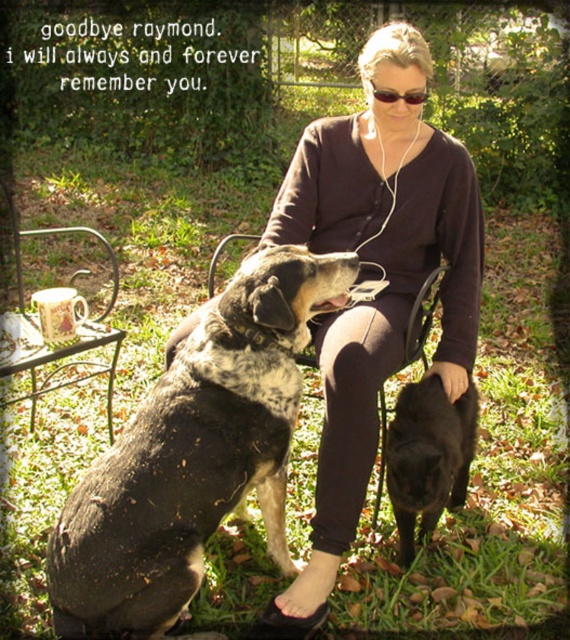
You are a photographer trying to capture both the speckled fur dog at center and the black matte dog at lower right in the same frame. Based on their positions and sizes, which dog should you focus on first to ensure both are in the frame?

The speckled fur dog at center might be wider than black matte dog at lower right, so you should focus on the speckled fur dog at center first to ensure both are in the frame.

Based on the photo, you are a photographer trying to capture a candid shot of the matte brown shirt at center and the speckled fur dog at center. Since you want to ensure both subjects are in focus, you need to know which one is taller. Can you tell me which one is taller?

The matte brown shirt at center is taller than the speckled fur dog at center.